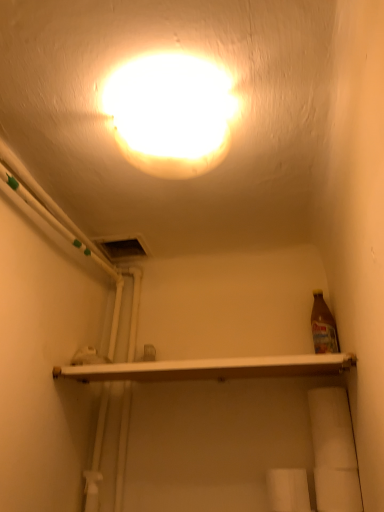
What do you see at coordinates (211, 368) in the screenshot? I see `white glossy shelf at center` at bounding box center [211, 368].

Find the location of a particular element. This screenshot has width=384, height=512. white matte toilet paper at lower right, the first toilet paper from the right is located at coordinates (337, 490).

Where is `matte white light at upper center`? This screenshot has width=384, height=512. matte white light at upper center is located at coordinates (171, 113).

The image size is (384, 512). I want to click on white glossy shelf at center, so click(x=211, y=368).

The image size is (384, 512). I want to click on toilet paper below the white matte toilet paper at lower right, which is the 2th toilet paper in left-to-right order (from the image's perspective), so click(288, 490).

From the image's perspective, would you say white matte toilet paper at lower center, which is the 1th toilet paper from left to right, is shown under white matte toilet paper at lower right, the first toilet paper from the right?

Yes, from the image's perspective, white matte toilet paper at lower center, which is the 1th toilet paper from left to right, is beneath white matte toilet paper at lower right, the first toilet paper from the right.

What's the angular difference between white matte toilet paper at lower center, positioned as the 2th toilet paper in right-to-left order, and white matte toilet paper at lower right, the first toilet paper from the right,'s facing directions?

They differ by 2.05 degrees in their facing directions.

Considering the sizes of objects white matte toilet paper at lower center, which is the 1th toilet paper from left to right, and white matte toilet paper at lower right, which is the 2th toilet paper in left-to-right order, in the image provided, who is wider, white matte toilet paper at lower center, which is the 1th toilet paper from left to right, or white matte toilet paper at lower right, which is the 2th toilet paper in left-to-right order,?

Wider between the two is white matte toilet paper at lower center, which is the 1th toilet paper from left to right.

Does white matte toilet paper at lower right, the first toilet paper from the right, have a smaller size compared to white glossy shelf at center?

Correct, white matte toilet paper at lower right, the first toilet paper from the right, occupies less space than white glossy shelf at center.

Considering the relative positions of white matte toilet paper at lower right, which is the 2th toilet paper in left-to-right order, and white glossy shelf at center in the image provided, is white matte toilet paper at lower right, which is the 2th toilet paper in left-to-right order, to the left of white glossy shelf at center from the viewer's perspective?

In fact, white matte toilet paper at lower right, which is the 2th toilet paper in left-to-right order, is to the right of white glossy shelf at center.

From the picture: Could you tell me if white matte toilet paper at lower right, which is the 2th toilet paper in left-to-right order, is facing white glossy shelf at center?

No, white matte toilet paper at lower right, which is the 2th toilet paper in left-to-right order, is not facing towards white glossy shelf at center.

Measure the distance between white matte toilet paper at lower center, which is the 1th toilet paper from left to right, and matte white light at upper center.

They are 35.64 inches apart.

Between white matte toilet paper at lower center, positioned as the 2th toilet paper in right-to-left order, and matte white light at upper center, which one has less height?

Standing shorter between the two is matte white light at upper center.

From the image's perspective, starting from the matte white light at upper center, which toilet paper is the 2nd one below? Please provide its 2D coordinates.

[(288, 490)]

Would you say white matte toilet paper at lower center, which is the 1th toilet paper from left to right, is inside or outside matte white light at upper center?

white matte toilet paper at lower center, which is the 1th toilet paper from left to right, is located beyond the bounds of matte white light at upper center.

Is point (147, 378) closer to camera compared to point (301, 511)?

No, (147, 378) is behind (301, 511).

From a real-world perspective, who is located lower, white glossy shelf at center or white matte toilet paper at lower center, which is the 1th toilet paper from left to right?

white matte toilet paper at lower center, which is the 1th toilet paper from left to right, from a real-world perspective.

Find the location of a particular element. Image resolution: width=384 pixels, height=512 pixels. the 1st toilet paper counting from the right of the white glossy shelf at center is located at coordinates (288, 490).

From the image's perspective, is white glossy shelf at center beneath white matte toilet paper at lower center, which is the 1th toilet paper from left to right?

No, from the image's perspective, white glossy shelf at center is not beneath white matte toilet paper at lower center, which is the 1th toilet paper from left to right.

Is white glossy shelf at center facing towards matte white light at upper center?

No, white glossy shelf at center is not aimed at matte white light at upper center.

Can you confirm if white glossy shelf at center is shorter than matte white light at upper center?

Indeed, white glossy shelf at center has a lesser height compared to matte white light at upper center.

From a real-world perspective, which is physically above, white glossy shelf at center or matte white light at upper center?

In real-world perspective, matte white light at upper center is above.

How different are the orientations of white glossy shelf at center and white matte toilet paper at lower right, the first toilet paper from the right, in degrees?

The angular difference between white glossy shelf at center and white matte toilet paper at lower right, the first toilet paper from the right, is 0.18 degrees.

You are a GUI agent. You are given a task and a screenshot of the screen. Output one action in this format:
    pyautogui.click(x=<x>, y=<y>)
    Task: Click on the 1st toilet paper behind the white glossy shelf at center, counting from the anchor's position
    This screenshot has height=512, width=384.
    Given the screenshot: What is the action you would take?
    pyautogui.click(x=337, y=490)

Considering the relative sizes of white glossy shelf at center and white matte toilet paper at lower right, the first toilet paper from the right, in the image provided, is white glossy shelf at center thinner than white matte toilet paper at lower right, the first toilet paper from the right,?

Incorrect, the width of white glossy shelf at center is not less than that of white matte toilet paper at lower right, the first toilet paper from the right.

Is white glossy shelf at center smaller than white matte toilet paper at lower right, the first toilet paper from the right?

Actually, white glossy shelf at center might be larger than white matte toilet paper at lower right, the first toilet paper from the right.

Is white matte toilet paper at lower right, which is the 2th toilet paper in left-to-right order, positioned beyond the bounds of white matte toilet paper at lower center, which is the 1th toilet paper from left to right?

white matte toilet paper at lower right, which is the 2th toilet paper in left-to-right order, lies outside white matte toilet paper at lower center, which is the 1th toilet paper from left to right,'s area.

Is white matte toilet paper at lower right, which is the 2th toilet paper in left-to-right order, placed right next to white matte toilet paper at lower center, which is the 1th toilet paper from left to right?

Indeed, white matte toilet paper at lower right, which is the 2th toilet paper in left-to-right order, and white matte toilet paper at lower center, which is the 1th toilet paper from left to right, are beside each other and touching.

How different are the orientations of white matte toilet paper at lower right, which is the 2th toilet paper in left-to-right order, and white matte toilet paper at lower center, which is the 1th toilet paper from left to right, in degrees?

2.05 degrees.

Considering the relative sizes of white matte toilet paper at lower right, which is the 2th toilet paper in left-to-right order, and white matte toilet paper at lower center, positioned as the 2th toilet paper in right-to-left order, in the image provided, is white matte toilet paper at lower right, which is the 2th toilet paper in left-to-right order, taller than white matte toilet paper at lower center, positioned as the 2th toilet paper in right-to-left order,?

No, white matte toilet paper at lower right, which is the 2th toilet paper in left-to-right order, is not taller than white matte toilet paper at lower center, positioned as the 2th toilet paper in right-to-left order.

Find the location of a particular element. The width and height of the screenshot is (384, 512). toilet paper lying above the white matte toilet paper at lower center, positioned as the 2th toilet paper in right-to-left order (from the image's perspective) is located at coordinates coord(337,490).

From the white glossy shelf at center, count 1st toilet papers backward and point to it. Please provide its 2D coordinates.

[(337, 490)]

Based on their spatial positions, is white matte toilet paper at lower right, which is the 2th toilet paper in left-to-right order, or matte white light at upper center closer to white glossy shelf at center?

The object closer to white glossy shelf at center is white matte toilet paper at lower right, which is the 2th toilet paper in left-to-right order.

Looking at the image, which one is located closer to matte white light at upper center, white glossy shelf at center or white matte toilet paper at lower right, the first toilet paper from the right?

The object closer to matte white light at upper center is white glossy shelf at center.

From the image, which object appears to be farther from white matte toilet paper at lower right, the first toilet paper from the right, white glossy shelf at center or white matte toilet paper at lower center, positioned as the 2th toilet paper in right-to-left order?

Based on the image, white glossy shelf at center appears to be further to white matte toilet paper at lower right, the first toilet paper from the right.

When comparing their distances from white matte toilet paper at lower right, which is the 2th toilet paper in left-to-right order, does white matte toilet paper at lower center, positioned as the 2th toilet paper in right-to-left order, or white glossy shelf at center seem closer?

The object closer to white matte toilet paper at lower right, which is the 2th toilet paper in left-to-right order, is white matte toilet paper at lower center, positioned as the 2th toilet paper in right-to-left order.

Which object lies further to the anchor point white matte toilet paper at lower center, positioned as the 2th toilet paper in right-to-left order, matte white light at upper center or white glossy shelf at center?

Among the two, matte white light at upper center is located further to white matte toilet paper at lower center, positioned as the 2th toilet paper in right-to-left order.

Looking at the image, which one is located further to white matte toilet paper at lower right, the first toilet paper from the right, white matte toilet paper at lower center, positioned as the 2th toilet paper in right-to-left order, or matte white light at upper center?

matte white light at upper center is positioned further to the anchor white matte toilet paper at lower right, the first toilet paper from the right.

From the image, which object appears to be nearer to matte white light at upper center, white matte toilet paper at lower right, which is the 2th toilet paper in left-to-right order, or white matte toilet paper at lower center, which is the 1th toilet paper from left to right?

white matte toilet paper at lower right, which is the 2th toilet paper in left-to-right order, lies closer to matte white light at upper center than the other object.

Based on their spatial positions, is matte white light at upper center or white matte toilet paper at lower center, which is the 1th toilet paper from left to right, further from white glossy shelf at center?

matte white light at upper center is further to white glossy shelf at center.

Where is `toilet paper between matte white light at upper center and white matte toilet paper at lower center, which is the 1th toilet paper from left to right, in the vertical direction`? This screenshot has width=384, height=512. toilet paper between matte white light at upper center and white matte toilet paper at lower center, which is the 1th toilet paper from left to right, in the vertical direction is located at coordinates tap(337, 490).

I want to click on shelf between matte white light at upper center and white matte toilet paper at lower center, which is the 1th toilet paper from left to right, in the up-down direction, so click(211, 368).

Find the location of a particular element. The height and width of the screenshot is (512, 384). toilet paper located between white glossy shelf at center and white matte toilet paper at lower right, the first toilet paper from the right, in the left-right direction is located at coordinates (288, 490).

Where is `shelf between matte white light at upper center and white matte toilet paper at lower right, the first toilet paper from the right, in the up-down direction`? This screenshot has height=512, width=384. shelf between matte white light at upper center and white matte toilet paper at lower right, the first toilet paper from the right, in the up-down direction is located at coordinates (211, 368).